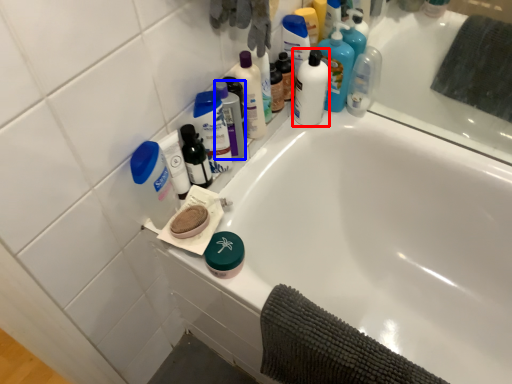
Question: Which object appears closest to the camera in this image, mouthwash (highlighted by a red box) or mouthwash (highlighted by a blue box)?

Choices:
 (A) mouthwash
 (B) mouthwash

Answer: (B)